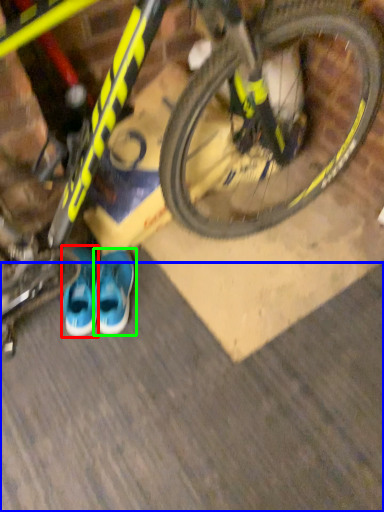
Question: Considering the real-world distances, which object is farthest from footwear (highlighted by a red box)? dirt track (highlighted by a blue box) or running shoe (highlighted by a green box)?

Choices:
 (A) dirt track
 (B) running shoe

Answer: (A)